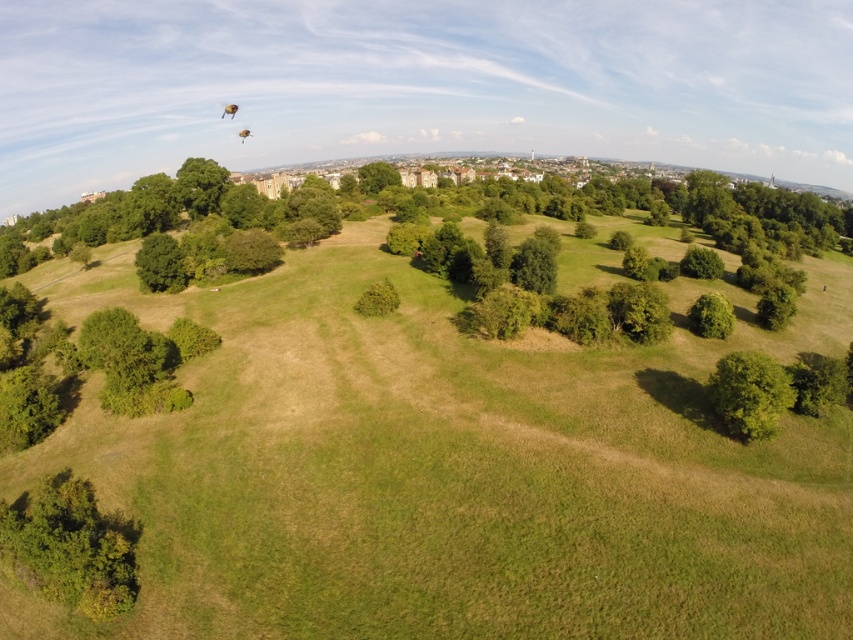
You are a drone operator flying a drone over the park. You notice both the green leafy bush at lower left and the green leafy tree at lower left in your camera view. Which one would appear larger in your camera view?

The green leafy bush at lower left would appear larger in the camera view because it is closer to the viewer than the green leafy tree at lower left.